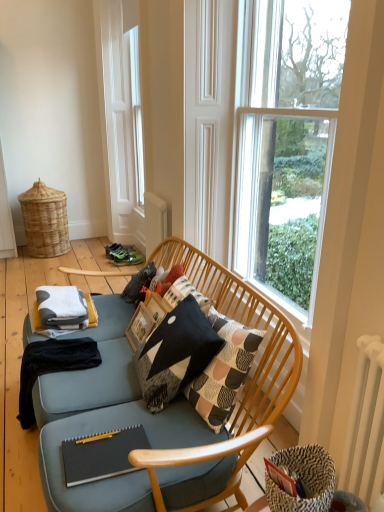
Question: Is clear glass window at upper right outside of white metallic radiator at right?

Choices:
 (A) no
 (B) yes

Answer: (B)

Question: From a real-world perspective, is clear glass window at upper right located higher than white metallic radiator at right?

Choices:
 (A) yes
 (B) no

Answer: (A)

Question: Is clear glass window at upper right thinner than white metallic radiator at right?

Choices:
 (A) no
 (B) yes

Answer: (A)

Question: Would you consider clear glass window at upper right to be distant from white metallic radiator at right?

Choices:
 (A) no
 (B) yes

Answer: (B)

Question: Does clear glass window at upper right have a smaller size compared to white metallic radiator at right?

Choices:
 (A) no
 (B) yes

Answer: (A)

Question: From the image's perspective, does clear glass window at upper right appear higher than white metallic radiator at right?

Choices:
 (A) no
 (B) yes

Answer: (B)

Question: Is black cotton blanket at lower left looking in the opposite direction of woven natural basket at left?

Choices:
 (A) no
 (B) yes

Answer: (A)

Question: From a real-world perspective, is black cotton blanket at lower left physically above woven natural basket at left?

Choices:
 (A) no
 (B) yes

Answer: (A)

Question: From a real-world perspective, is black cotton blanket at lower left located beneath woven natural basket at left?

Choices:
 (A) no
 (B) yes

Answer: (B)

Question: Is there a large distance between black cotton blanket at lower left and woven natural basket at left?

Choices:
 (A) no
 (B) yes

Answer: (B)

Question: Considering the relative sizes of black cotton blanket at lower left and woven natural basket at left in the image provided, is black cotton blanket at lower left smaller than woven natural basket at left?

Choices:
 (A) yes
 (B) no

Answer: (A)

Question: Does black cotton blanket at lower left have a lesser height compared to woven natural basket at left?

Choices:
 (A) yes
 (B) no

Answer: (A)

Question: Considering the relative positions of black matte notebook at lower center and clear glass window at upper right in the image provided, is black matte notebook at lower center to the left of clear glass window at upper right from the viewer's perspective?

Choices:
 (A) no
 (B) yes

Answer: (B)